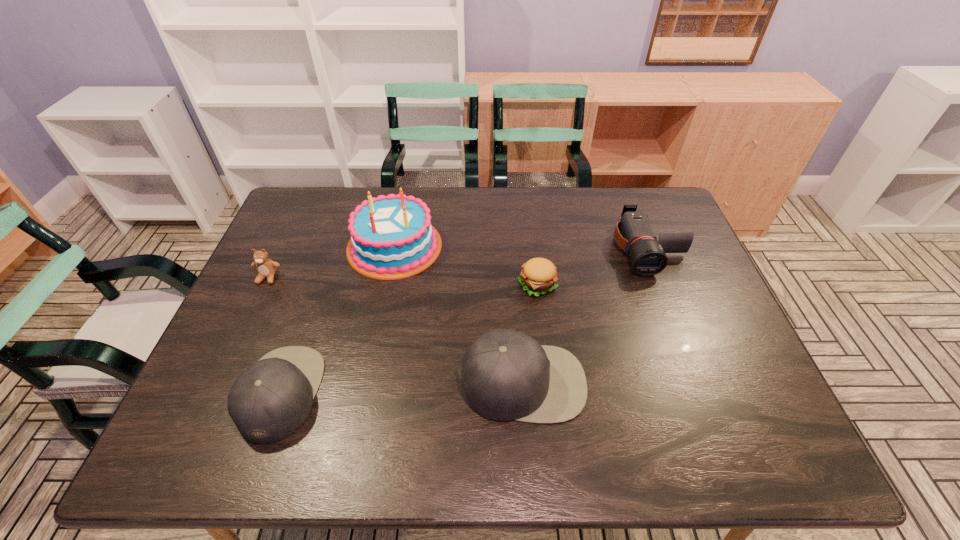
In order to click on blank space located 0.390m on the left of the hamburger in this screenshot , I will do `click(382, 285)`.

Identify the location of vacant position located on the front-facing side of the teddy bear. Image resolution: width=960 pixels, height=540 pixels. (234, 350).

This screenshot has height=540, width=960. What are the coordinates of `birthday cake located in the far edge section of the desktop` in the screenshot? It's located at (391, 237).

Identify the location of camcorder that is at the far edge. (633, 233).

Where is `cap at the left edge`? The image size is (960, 540). cap at the left edge is located at coordinates (270, 400).

Locate an element on the screen. teddy bear that is positioned at the left edge is located at coordinates (266, 268).

The height and width of the screenshot is (540, 960). I want to click on object that is positioned at the right edge, so click(x=633, y=233).

At what (x,y) coordinates should I click in order to perform the action: click on object present at the near left corner. Please return your answer as a coordinate pair (x, y). Looking at the image, I should click on (270, 400).

Locate an element on the screen. This screenshot has width=960, height=540. object located in the far right corner section of the desktop is located at coordinates pos(633,233).

Where is `blank area at the far edge`? The height and width of the screenshot is (540, 960). blank area at the far edge is located at coordinates (557, 207).